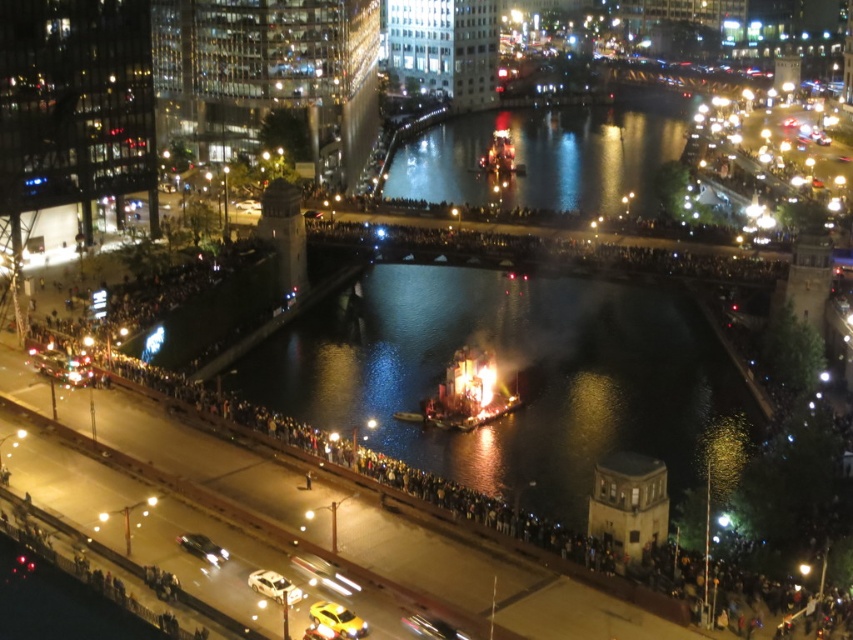
Question: Which of the following is the closest to the observer?

Choices:
 (A) (416, 179)
 (B) (529, 419)
 (C) (490, 392)

Answer: (B)

Question: Which of the following is the farthest from the observer?

Choices:
 (A) shiny metallic structure at center
 (B) reflective glass water at center

Answer: (B)

Question: Does reflective glass water at center have a lesser width compared to shiny metallic structure at center?

Choices:
 (A) yes
 (B) no

Answer: (B)

Question: Is the position of dark reflective water at center less distant than that of reflective glass water at center?

Choices:
 (A) no
 (B) yes

Answer: (B)

Question: Is dark reflective water at center wider than shiny metallic structure at center?

Choices:
 (A) yes
 (B) no

Answer: (A)

Question: Which point is closer to the camera taking this photo?

Choices:
 (A) (647, 120)
 (B) (402, 266)

Answer: (B)